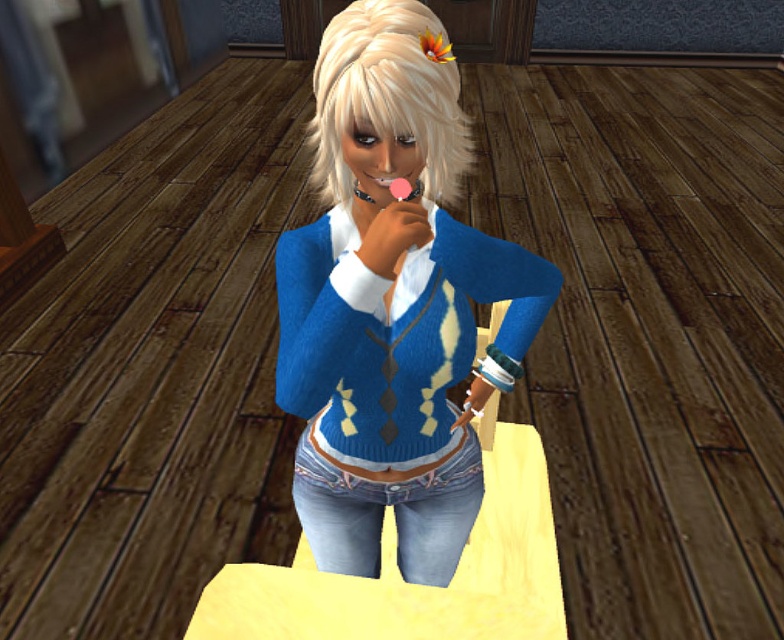
Is point (452, 444) more distant than point (416, 74)?

Yes, point (452, 444) is behind point (416, 74).

The height and width of the screenshot is (640, 784). Find the location of `blue knitted sweater at center`. blue knitted sweater at center is located at coordinates (394, 304).

Who is more forward, (379, 1) or (369, 548)?

Point (379, 1) is in front.

Can you confirm if blondehair at center is positioned below denim jeans at center?

Actually, blondehair at center is above denim jeans at center.

Does point (363, 108) come farther from viewer compared to point (438, 506)?

No, it is in front of (438, 506).

You are a GUI agent. You are given a task and a screenshot of the screen. Output one action in this format:
    pyautogui.click(x=<x>, y=<y>)
    Task: Click on the blondehair at center
    
    Given the screenshot: What is the action you would take?
    pyautogui.click(x=387, y=93)

Is blue knitted sweater at center to the left of blue knitted cardigan at center from the viewer's perspective?

Indeed, blue knitted sweater at center is positioned on the left side of blue knitted cardigan at center.

Image resolution: width=784 pixels, height=640 pixels. Describe the element at coordinates (394, 304) in the screenshot. I see `blue knitted sweater at center` at that location.

Which is in front, point (423, 132) or point (289, 300)?

Point (423, 132) is in front.

Where is `blue knitted sweater at center`? The width and height of the screenshot is (784, 640). blue knitted sweater at center is located at coordinates (394, 304).